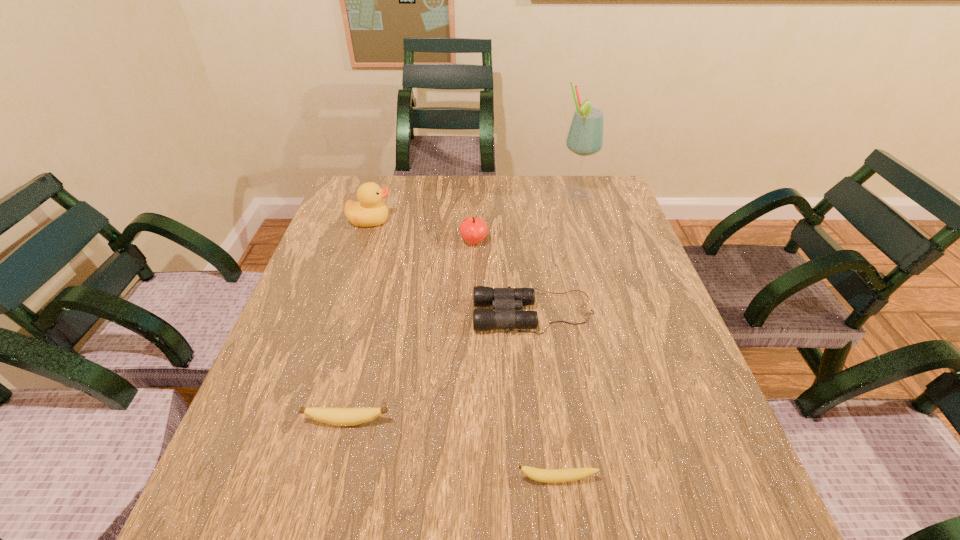
Find the location of `the nearest object`. the nearest object is located at coordinates (541, 475).

The width and height of the screenshot is (960, 540). What are the coordinates of `the right banana` in the screenshot? It's located at (541, 475).

The image size is (960, 540). I want to click on free space located on the front of the farthest object, so click(x=600, y=277).

At what (x,y) coordinates should I click in order to perform the action: click on free region located at the beak of the fifth shortest object. Please return your answer as a coordinate pair (x, y). This screenshot has width=960, height=540. Looking at the image, I should click on (409, 221).

What are the coordinates of `blank area located on the left of the fourth nearest object` in the screenshot? It's located at (427, 242).

This screenshot has width=960, height=540. Find the location of `vacant space situated at the eyepiece of the third nearest object`. vacant space situated at the eyepiece of the third nearest object is located at coordinates (400, 313).

The width and height of the screenshot is (960, 540). What are the coordinates of `blank space located at the eyepiece of the third nearest object` in the screenshot? It's located at (370, 313).

The width and height of the screenshot is (960, 540). I want to click on free region located 0.130m at the eyepiece of the third nearest object, so click(418, 313).

The image size is (960, 540). What are the coordinates of `vacant space located 0.090m on the right of the left banana` in the screenshot? It's located at (439, 422).

Locate an element on the screen. The height and width of the screenshot is (540, 960). free space located on the upward curve of the nearest object is located at coordinates (562, 518).